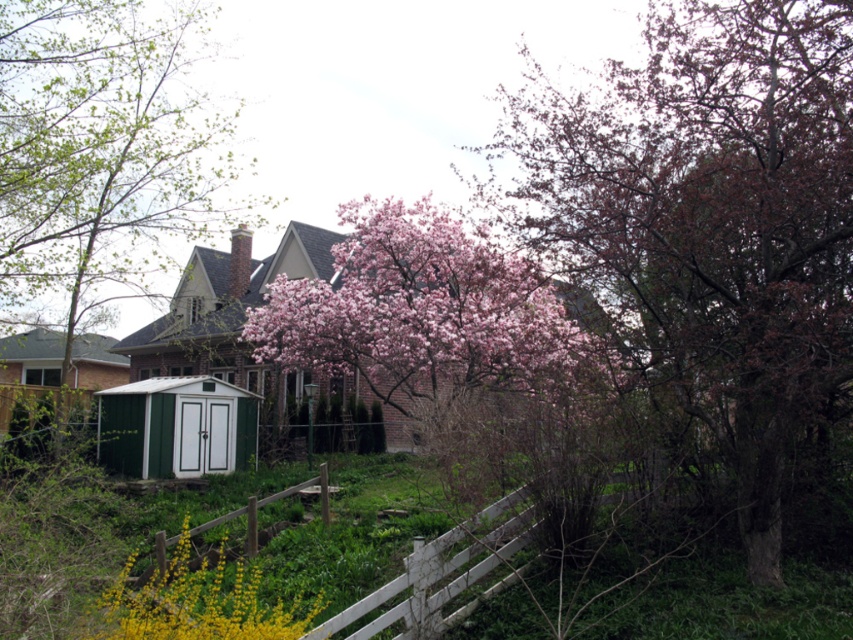
Question: Is pink bloom at center to the right of green plastic shed at lower left from the viewer's perspective?

Choices:
 (A) no
 (B) yes

Answer: (B)

Question: Estimate the real-world distances between objects in this image. Which object is closer to the green matte shed at lower left?

Choices:
 (A) green painted wood shed at center
 (B) green painted wood shed at lower left

Answer: (A)

Question: Is green painted wood shed at center further to camera compared to yellow matte flower at lower left?

Choices:
 (A) yes
 (B) no

Answer: (A)

Question: Which of these objects is positioned farthest from the green painted wood shed at center?

Choices:
 (A) pink bloom at center
 (B) green matte shed at lower left
 (C) yellow matte flower at lower left

Answer: (C)

Question: Is pink textured tree at upper right behind green painted wood shed at lower left?

Choices:
 (A) no
 (B) yes

Answer: (A)

Question: Among these objects, which one is nearest to the camera?

Choices:
 (A) green painted wood shed at center
 (B) pink bloom at center

Answer: (B)